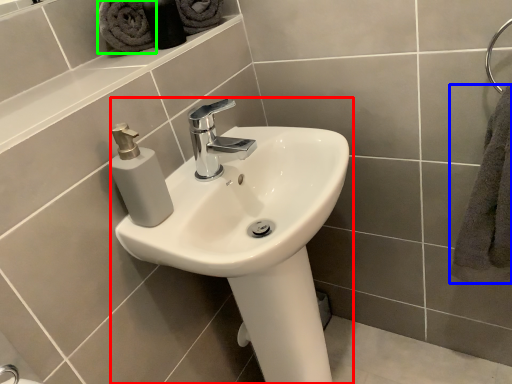
Question: Based on their relative distances, which object is nearer to sink (highlighted by a red box)? Choose from bath towel (highlighted by a blue box) and bath towel (highlighted by a green box).

Choices:
 (A) bath towel
 (B) bath towel

Answer: (A)